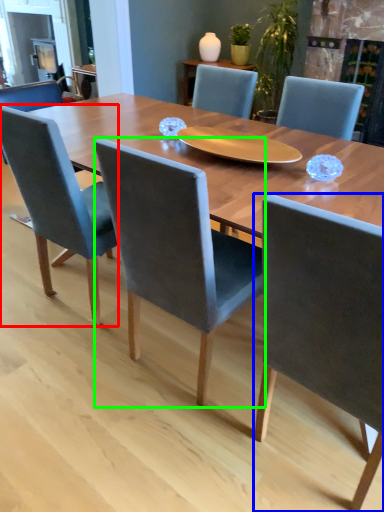
Question: Which object is the farthest from chair (highlighted by a red box)? Choose among these: chair (highlighted by a blue box) or chair (highlighted by a green box).

Choices:
 (A) chair
 (B) chair

Answer: (A)